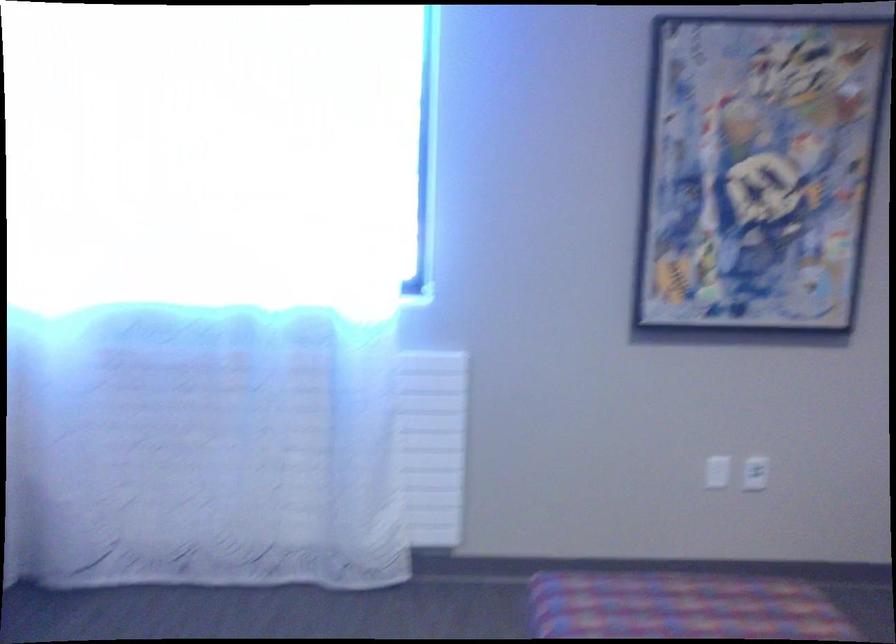
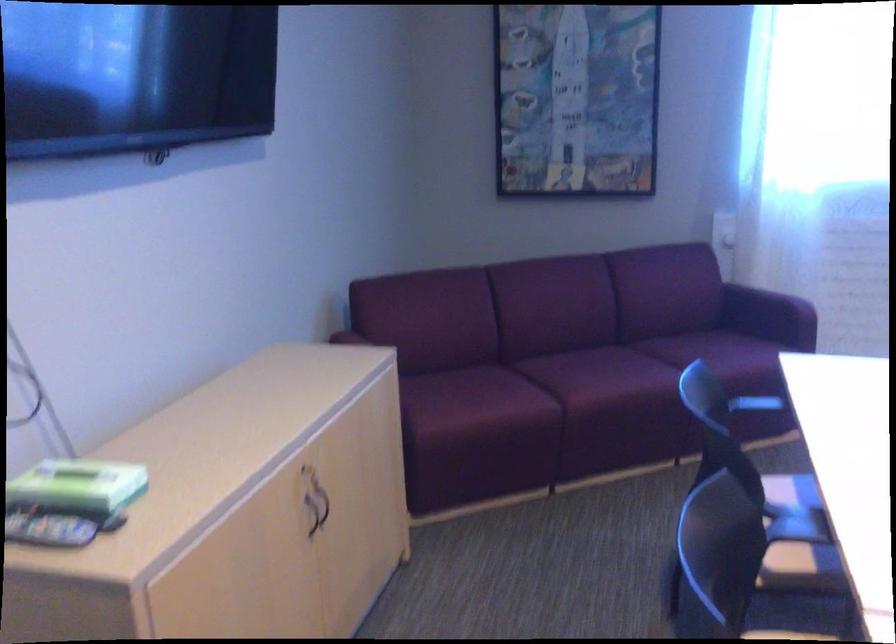
In the scene shown: In a continuous first-person perspective shot, in which direction is the camera moving?

The movement direction of the cameraman is left, backward.